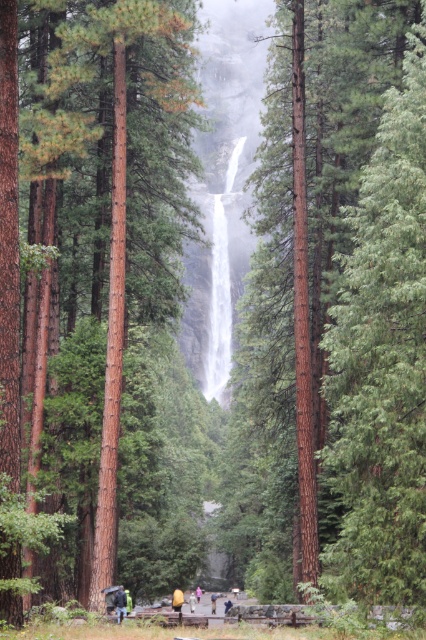
Does smooth brown tree trunk at center have a greater width compared to dark blue jeans at center?

Indeed, smooth brown tree trunk at center has a greater width compared to dark blue jeans at center.

Is smooth brown tree trunk at center above dark blue jeans at center?

Yes, smooth brown tree trunk at center is above dark blue jeans at center.

The width and height of the screenshot is (426, 640). What are the coordinates of `smooth brown tree trunk at center` in the screenshot? It's located at (124, 294).

Is green rough bark tree at center smaller than dark blue jeans at center?

No.

Does point (253, 516) come in front of point (121, 602)?

That is False.

The image size is (426, 640). I want to click on green rough bark tree at center, so click(x=365, y=298).

Does green rough bark tree at center have a greater height compared to smooth brown tree trunk at center?

Indeed, green rough bark tree at center has a greater height compared to smooth brown tree trunk at center.

Between green rough bark tree at center and smooth brown tree trunk at center, which one appears on the left side from the viewer's perspective?

smooth brown tree trunk at center is more to the left.

Is point (264, 272) positioned after point (155, 538)?

No.

In order to click on green rough bark tree at center in this screenshot , I will do `click(365, 298)`.